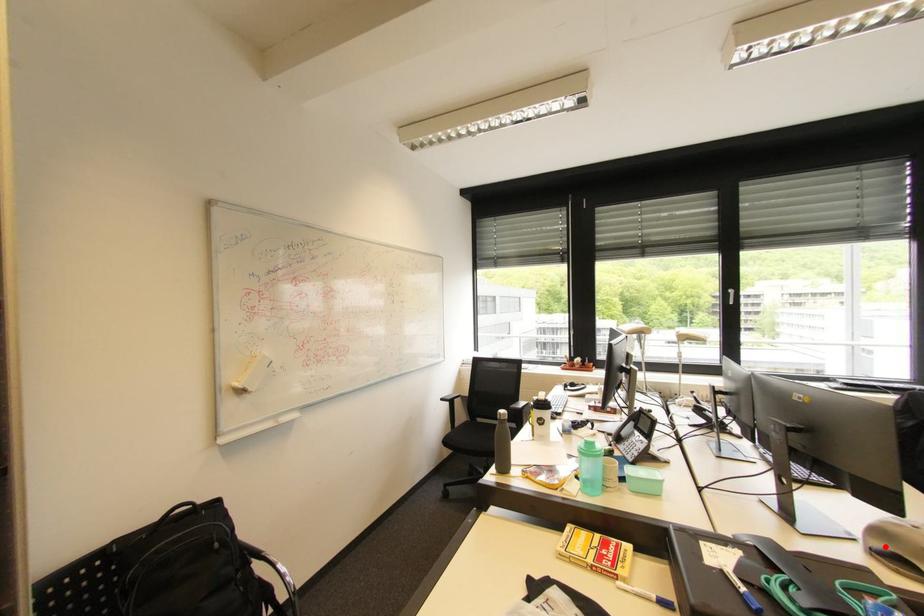
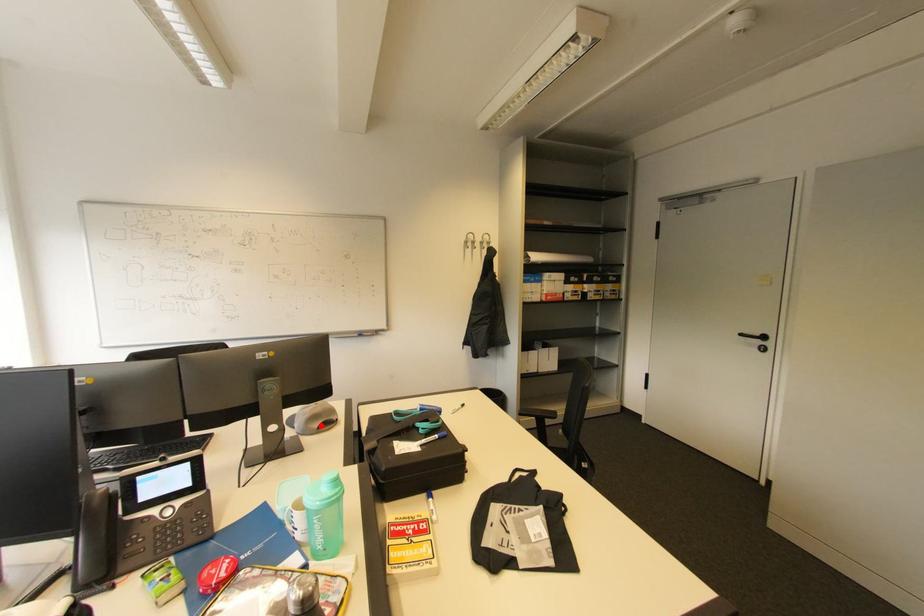
I am providing you with two images of the same scene from different viewpoints. A red point is marked on the first image and another point is marked on the second image. Does the point marked in image1 correspond to the same location as the one in image2?

Yes